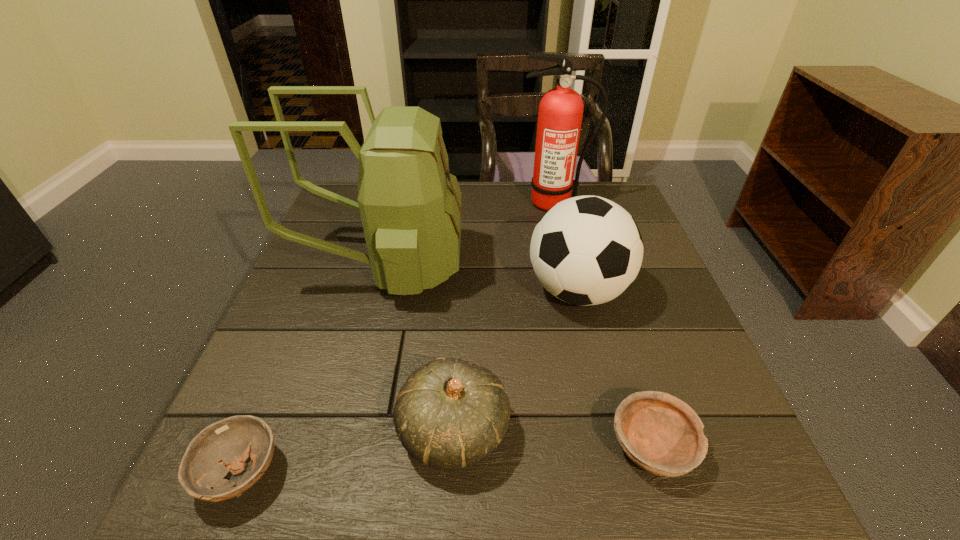
Where is `vacant space that's between the fire extinguisher and the right bowl`? vacant space that's between the fire extinguisher and the right bowl is located at coordinates (603, 325).

The width and height of the screenshot is (960, 540). Find the location of `vacant region between the backpack and the gourd`. vacant region between the backpack and the gourd is located at coordinates (419, 349).

Where is `object that ranks as the fifth closest to the third tallest object`? Image resolution: width=960 pixels, height=540 pixels. object that ranks as the fifth closest to the third tallest object is located at coordinates (224, 446).

Select which object appears as the fifth closest to the right bowl. Please provide its 2D coordinates. Your answer should be formatted as a tuple, i.e. [(x, y)], where the tuple contains the x and y coordinates of a point satisfying the conditions above.

[(560, 114)]

Image resolution: width=960 pixels, height=540 pixels. I want to click on vacant region that satisfies the following two spatial constraints: 1. on the back side of the soccer ball; 2. on the front pocket of the backpack, so click(571, 267).

Identify the location of free space that satisfies the following two spatial constraints: 1. on the front pocket of the backpack; 2. on the back side of the third tallest object. The image size is (960, 540). (377, 291).

Locate an element on the screen. Image resolution: width=960 pixels, height=540 pixels. vacant point that satisfies the following two spatial constraints: 1. on the handle side of the fire extinguisher; 2. on the right side of the right bowl is located at coordinates (612, 447).

Find the location of `free location that satisfies the following two spatial constraints: 1. on the front pocket of the fourth tallest object; 2. on the right side of the backpack`. free location that satisfies the following two spatial constraints: 1. on the front pocket of the fourth tallest object; 2. on the right side of the backpack is located at coordinates point(341,431).

At what (x,y) coordinates should I click in order to perform the action: click on free space that satisfies the following two spatial constraints: 1. on the front pocket of the backpack; 2. on the left side of the soccer ball. Please return your answer as a coordinate pair (x, y). The height and width of the screenshot is (540, 960). Looking at the image, I should click on (377, 291).

Identify the location of free space that satisfies the following two spatial constraints: 1. on the back side of the soccer ball; 2. on the front pocket of the backpack. pyautogui.click(x=571, y=267).